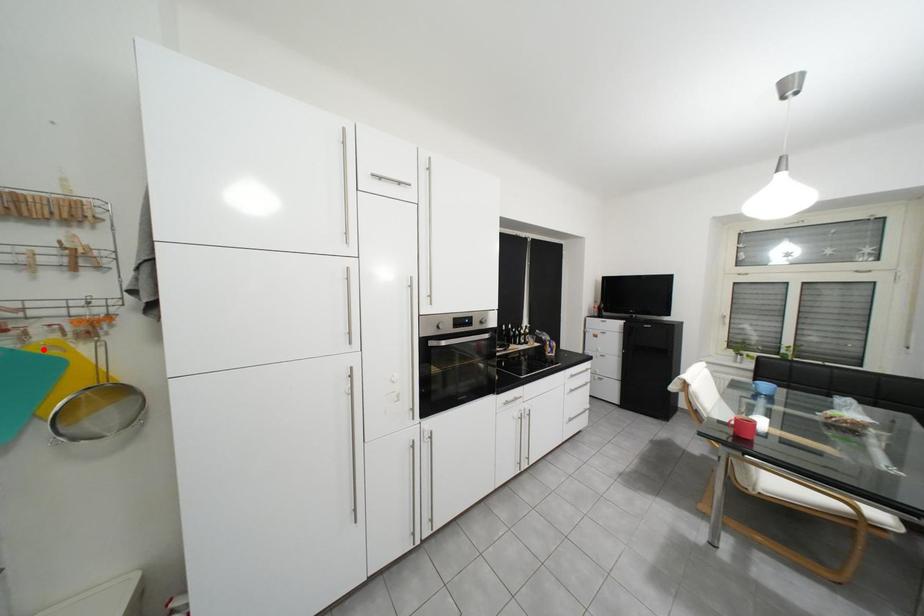
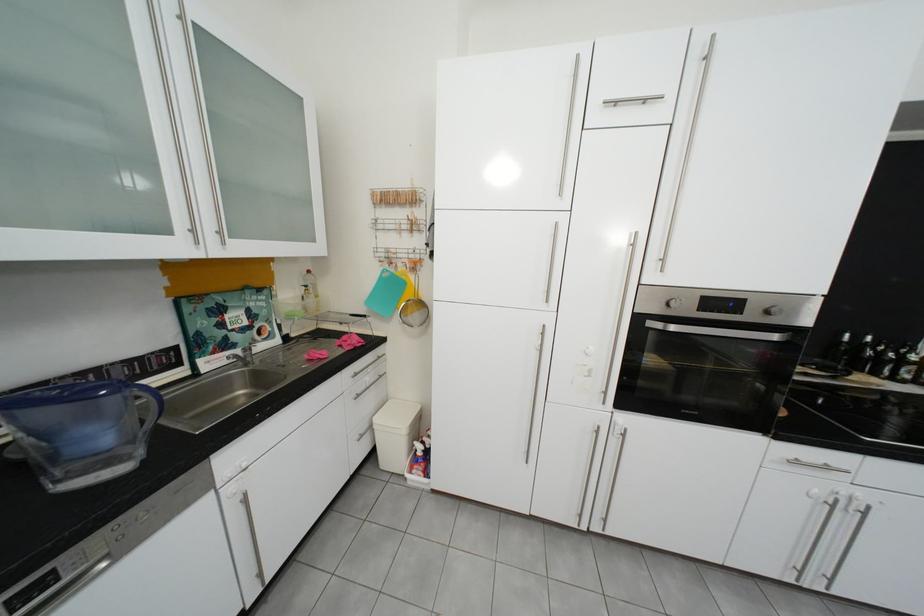
Find the pixel in the second image that matches the highlighted location in the first image.

(409, 275)